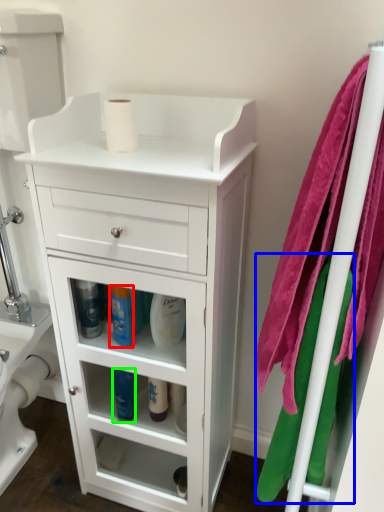
Question: Considering the real-world distances, which object is closest to cleaning product (highlighted by a red box)? bath towel (highlighted by a blue box) or cleaning product (highlighted by a green box).

Choices:
 (A) bath towel
 (B) cleaning product

Answer: (B)